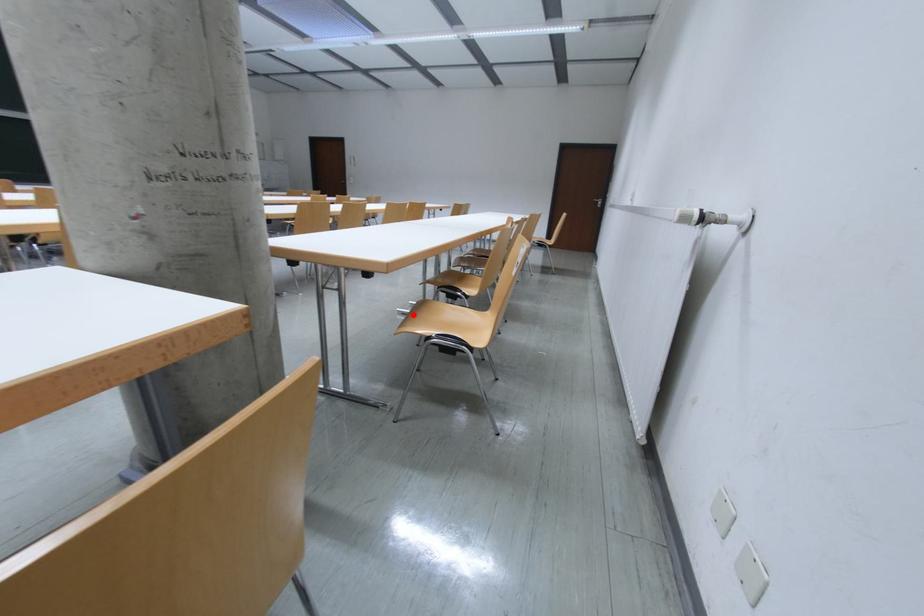
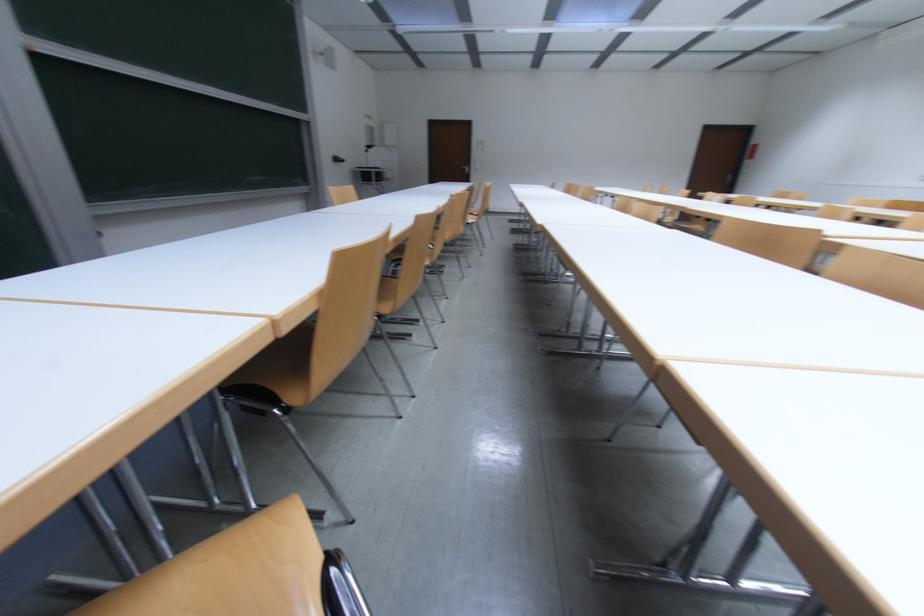
Question: I am providing you with two images of the same scene from different viewpoints. A red point is marked on the first image. At the location where the point appears in image 1, is it still visible in image 2?

Choices:
 (A) Yes
 (B) No

Answer: (B)